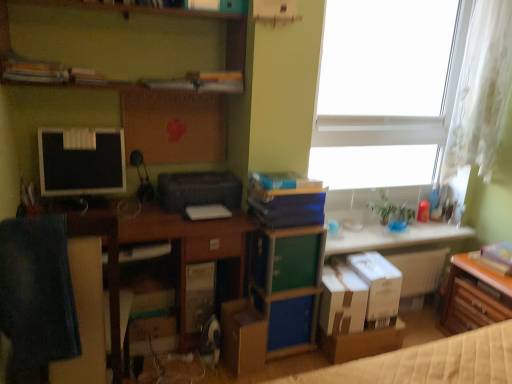
The width and height of the screenshot is (512, 384). Find the location of `blank space above brown cardboard box at center, which is the fourth cardboard box from right to left (from a real-world perspective)`. blank space above brown cardboard box at center, which is the fourth cardboard box from right to left (from a real-world perspective) is located at coordinates (253, 310).